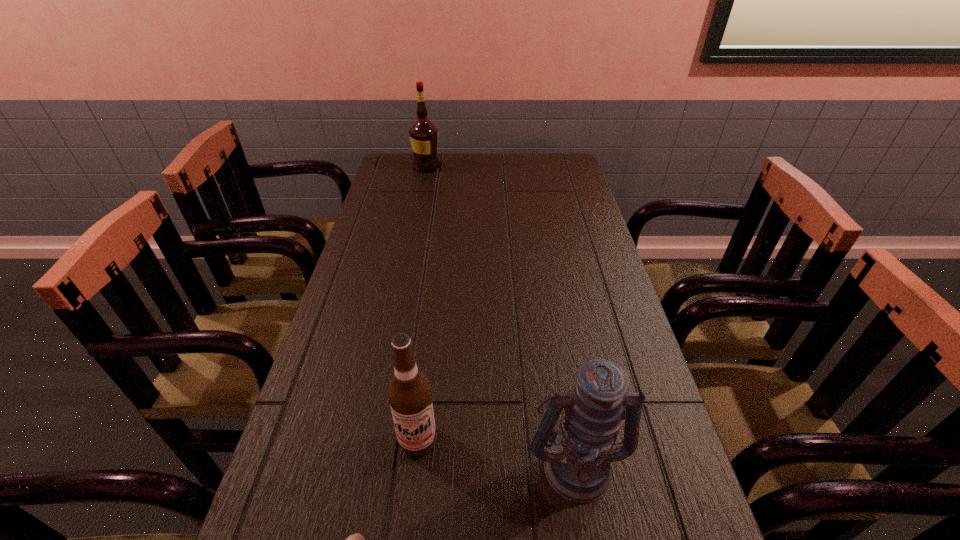
Locate an element on the screen. free space at the left edge is located at coordinates (339, 291).

Identify the location of vacant space at the right edge of the desktop. (566, 259).

I want to click on vacant space at the far left corner of the desktop, so pos(389,168).

In the image, there is a desktop. In order to click on vacant space at the far right corner in this screenshot , I will do `click(559, 158)`.

What are the coordinates of `free area in between the nearer alcohol and the farthest object` in the screenshot? It's located at (422, 303).

You are a GUI agent. You are given a task and a screenshot of the screen. Output one action in this format:
    pyautogui.click(x=<x>, y=<y>)
    Task: Click on the vacant area between the rightmost object and the farther alcohol
    
    Given the screenshot: What is the action you would take?
    pyautogui.click(x=501, y=316)

Find the location of a particular element. free point between the lantern and the farthest object is located at coordinates (501, 316).

Identify the location of vacant area between the nearer alcohol and the farther alcohol. (422, 303).

Where is `free spot between the lantern and the farther alcohol`? This screenshot has height=540, width=960. free spot between the lantern and the farther alcohol is located at coordinates 501,316.

Find the location of a particular element. free space between the lantern and the nearer alcohol is located at coordinates (497, 453).